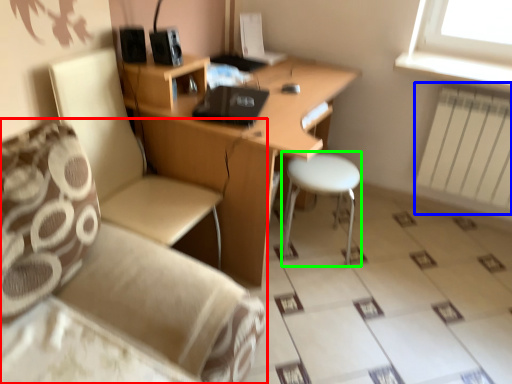
Question: Which is farther away from studio couch (highlighted by a red box)? radiator (highlighted by a blue box) or bar stool (highlighted by a green box)?

Choices:
 (A) radiator
 (B) bar stool

Answer: (A)